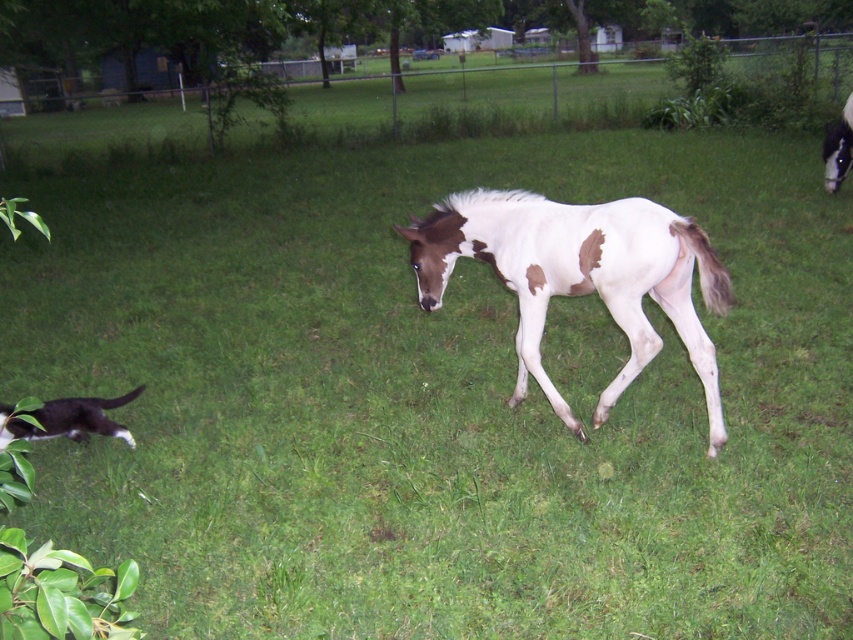
Question: Which object is the farthest from the black and white fur pony at lower left?

Choices:
 (A) white glossy horse at upper right
 (B) white speckled horse at center

Answer: (A)

Question: Which of the following is the closest to the observer?

Choices:
 (A) (36, 433)
 (B) (596, 236)
 (C) (831, 129)

Answer: (B)

Question: Can you confirm if black and white fur pony at lower left is thinner than white glossy horse at upper right?

Choices:
 (A) yes
 (B) no

Answer: (B)

Question: Considering the relative positions of white speckled horse at center and black and white fur pony at lower left in the image provided, where is white speckled horse at center located with respect to black and white fur pony at lower left?

Choices:
 (A) above
 (B) below

Answer: (A)

Question: Observing the image, what is the correct spatial positioning of black and white fur pony at lower left in reference to white glossy horse at upper right?

Choices:
 (A) above
 (B) below

Answer: (B)

Question: Based on their relative distances, which object is nearer to the white glossy horse at upper right?

Choices:
 (A) black and white fur pony at lower left
 (B) white speckled horse at center

Answer: (B)